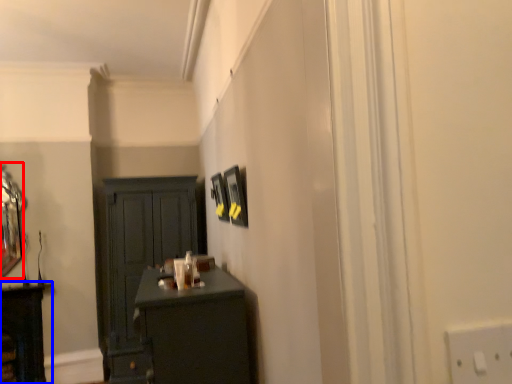
Question: Which point is closer to the camera, mirror (highlighted by a red box) or cabinetry (highlighted by a blue box)?

Choices:
 (A) mirror
 (B) cabinetry

Answer: (B)